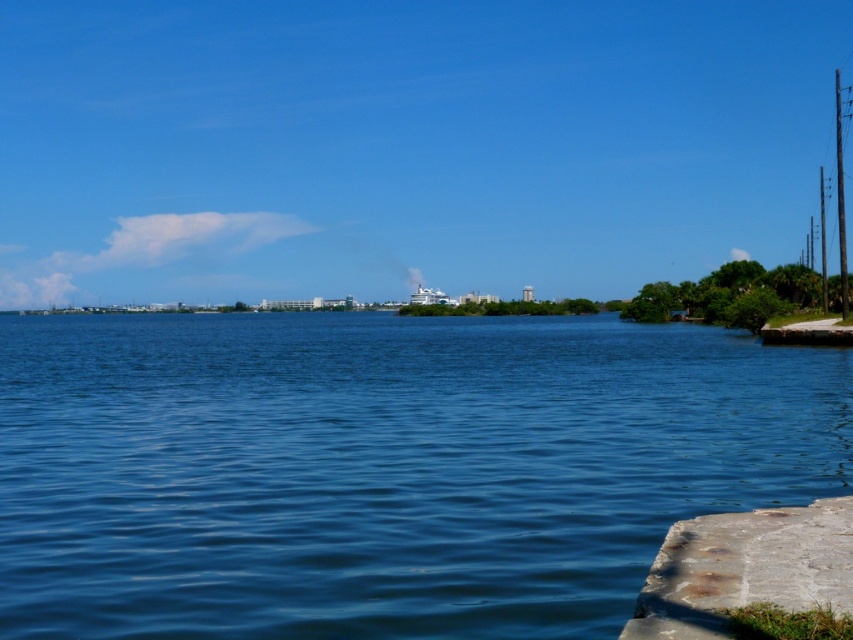
Describe the element at coordinates (383, 467) in the screenshot. I see `blue water at center` at that location.

How much distance is there between blue water at center and white glossy cruise ship at center?

blue water at center and white glossy cruise ship at center are 182.92 meters apart from each other.

Which is in front, point (195, 332) or point (418, 294)?

Positioned in front is point (195, 332).

The height and width of the screenshot is (640, 853). I want to click on blue water at center, so click(383, 467).

Does blue water at center have a lesser width compared to concrete at lower right?

No, blue water at center is not thinner than concrete at lower right.

Can you confirm if blue water at center is positioned to the left of concrete at lower right?

Yes, blue water at center is to the left of concrete at lower right.

This screenshot has width=853, height=640. In order to click on blue water at center in this screenshot , I will do `click(383, 467)`.

Who is lower down, concrete at lower right or white glossy cruise ship at center?

concrete at lower right

Does concrete at lower right have a greater height compared to white glossy cruise ship at center?

No, concrete at lower right is not taller than white glossy cruise ship at center.

Is point (677, 586) in front of point (427, 304)?

Yes, it is in front of point (427, 304).

Find the location of `concrete at lower right`. concrete at lower right is located at coordinates (746, 568).